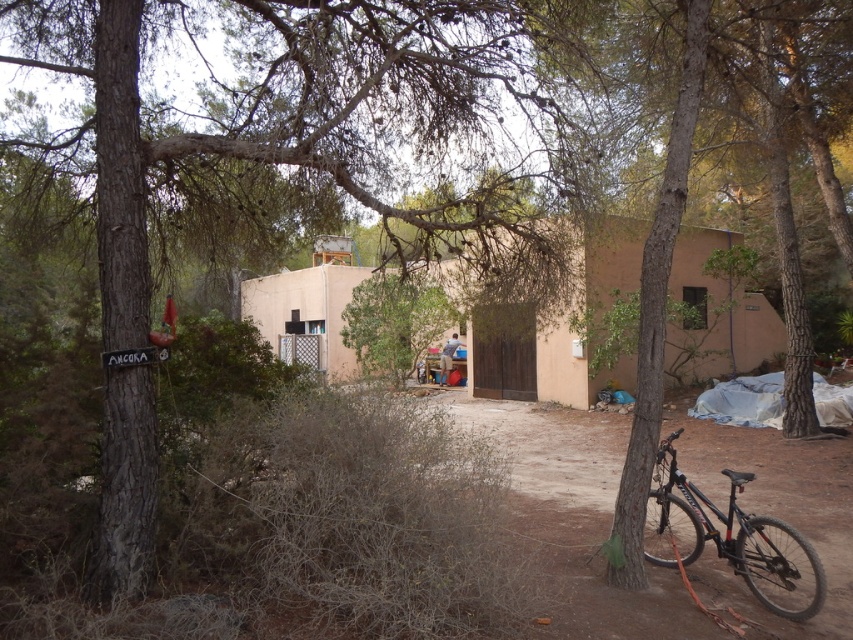
Who is lower down, brown rough tree at left or beige stucco hut at center?

beige stucco hut at center is below.

I want to click on brown rough tree at left, so click(x=315, y=129).

Can you confirm if brown rough tree at left is positioned to the right of black matte mountain bike at lower right?

Incorrect, brown rough tree at left is not on the right side of black matte mountain bike at lower right.

Does brown rough tree at left have a lesser width compared to black matte mountain bike at lower right?

Incorrect, brown rough tree at left's width is not less than black matte mountain bike at lower right's.

This screenshot has height=640, width=853. What do you see at coordinates (315, 129) in the screenshot?
I see `brown rough tree at left` at bounding box center [315, 129].

The height and width of the screenshot is (640, 853). What are the coordinates of `brown rough tree at left` in the screenshot? It's located at (315, 129).

Does beige stucco hut at center appear under black matte mountain bike at lower right?

Actually, beige stucco hut at center is above black matte mountain bike at lower right.

Looking at this image, who is higher up, beige stucco hut at center or black matte mountain bike at lower right?

Positioned higher is beige stucco hut at center.

Does point (631, 236) come closer to viewer compared to point (766, 515)?

That is False.

The image size is (853, 640). I want to click on beige stucco hut at center, so pos(563,324).